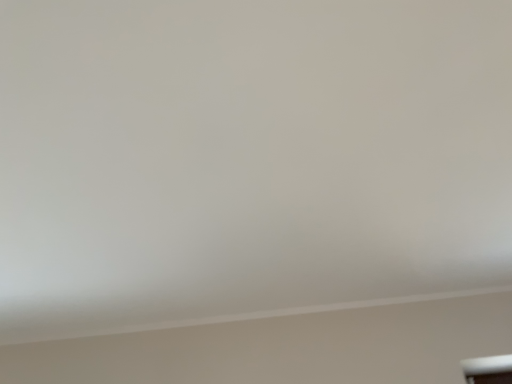
The image size is (512, 384). Describe the element at coordinates (488, 370) in the screenshot. I see `white glossy light switch at lower right` at that location.

The height and width of the screenshot is (384, 512). Find the location of `white glossy light switch at lower right`. white glossy light switch at lower right is located at coordinates (488, 370).

In order to click on white glossy light switch at lower right in this screenshot , I will do `click(488, 370)`.